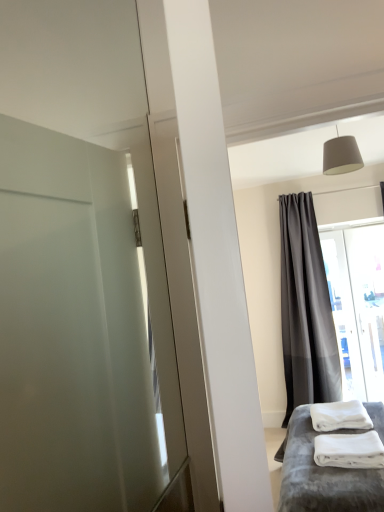
Image resolution: width=384 pixels, height=512 pixels. In order to click on vacant space in front of white soft towels at lower right in this screenshot , I will do `click(351, 483)`.